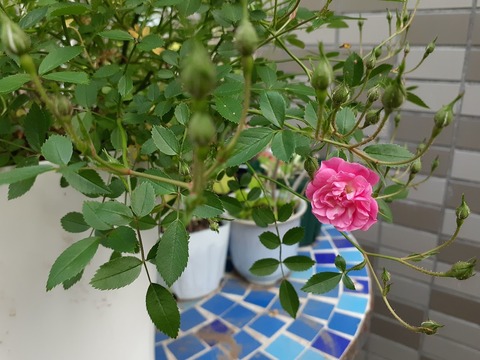
The image size is (480, 360). I want to click on side of table, so click(360, 340).